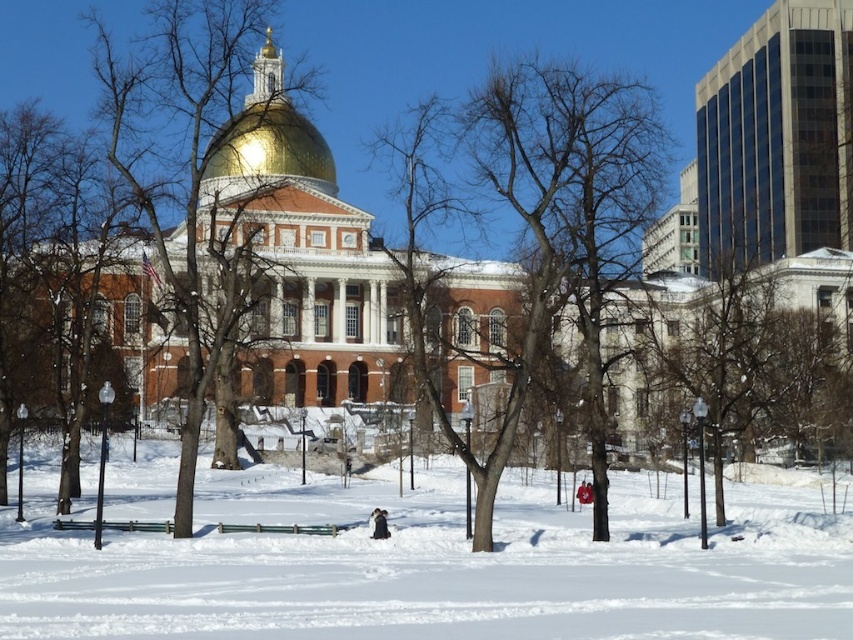
Question: Which of the following is the farthest from the observer?

Choices:
 (A) wooden park bench at center
 (B) brown bark tree at center
 (C) gold metallic dome at center
 (D) white powdery snow at center

Answer: (C)

Question: Is gold metallic dome at center above wooden park bench at lower center?

Choices:
 (A) no
 (B) yes

Answer: (B)

Question: Is white powdery snow at center positioned behind wooden park bench at center?

Choices:
 (A) yes
 (B) no

Answer: (B)

Question: Which object appears farthest from the camera in this image?

Choices:
 (A) gold metallic dome at center
 (B) white powdery snow at center

Answer: (A)

Question: Is bare wood tree at center closer to the viewer compared to gold metallic dome at center?

Choices:
 (A) no
 (B) yes

Answer: (B)

Question: Estimate the real-world distances between objects in this image. Which object is closer to the brown bark tree at center?

Choices:
 (A) bare wood tree at center
 (B) wooden park bench at lower center

Answer: (A)